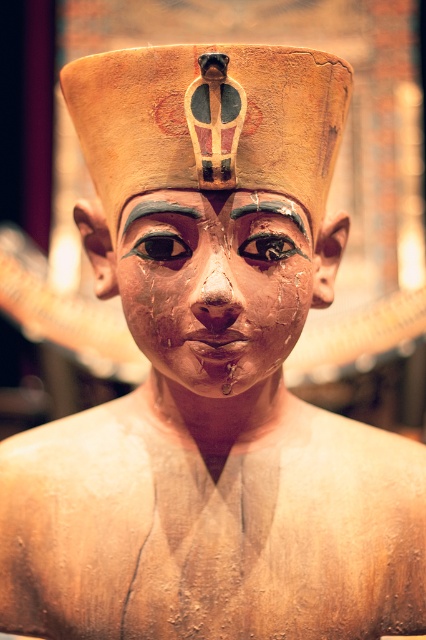
You are an archaeologist examining the statue and notice two points marked on the headdress. The points are labeled as point 1 at coordinates (230,205) and point 2 at (276,252). Based on the statue, which point is closer to the viewer?

Point 1 at coordinates (230,205) is closer to the viewer since it is in front of point 2 at (276,252).

You are an art conservator examining the statue. You need to determine the placement of the matte gold forehead at center and the shiny black eye at center. Which object is located to the left of the other?

The matte gold forehead at center is positioned on the left side of the shiny black eye at center.